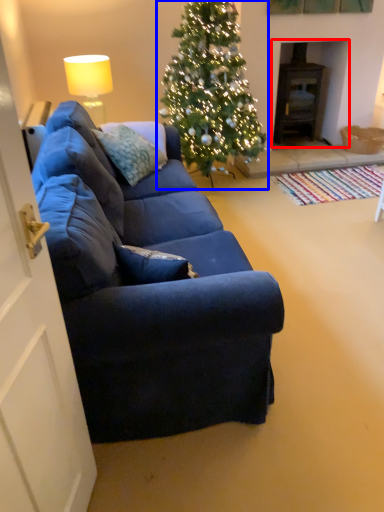
Question: Which object is closer to the camera taking this photo, fireplace (highlighted by a red box) or christmas tree (highlighted by a blue box)?

Choices:
 (A) fireplace
 (B) christmas tree

Answer: (B)